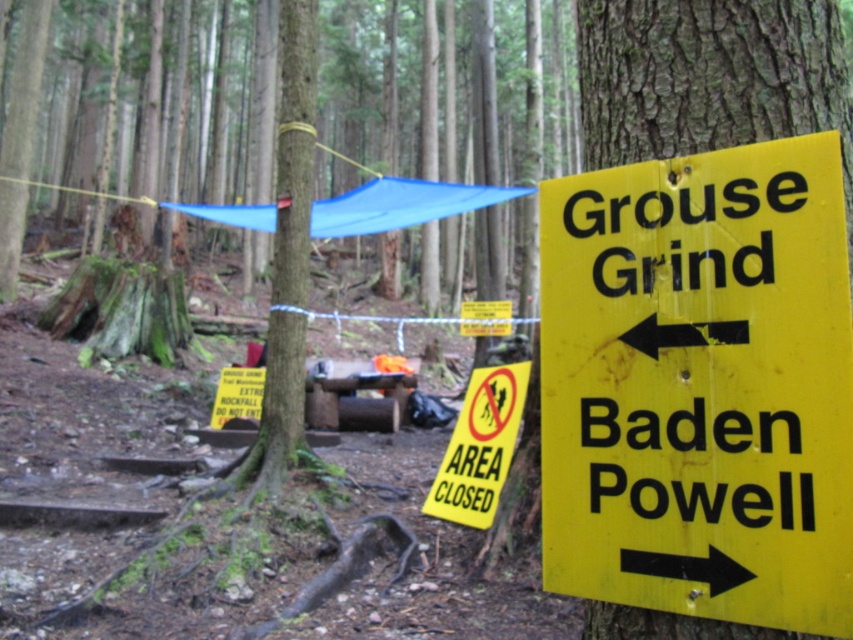
Question: Among these points, which one is farthest from the camera?

Choices:
 (A) (505, 467)
 (B) (695, 609)

Answer: (A)

Question: Does yellow matte sign at right appear on the left side of yellow paper sign at center?

Choices:
 (A) no
 (B) yes

Answer: (A)

Question: Which point appears closest to the camera in this image?

Choices:
 (A) (502, 412)
 (B) (631, 436)

Answer: (B)

Question: Among these objects, which one is nearest to the camera?

Choices:
 (A) yellow paper sign at center
 (B) yellow matte sign at right

Answer: (B)

Question: Where is yellow matte sign at right located in relation to yellow paper sign at center in the image?

Choices:
 (A) below
 (B) above

Answer: (B)

Question: Is yellow matte sign at right to the right of yellow paper sign at center from the viewer's perspective?

Choices:
 (A) yes
 (B) no

Answer: (A)